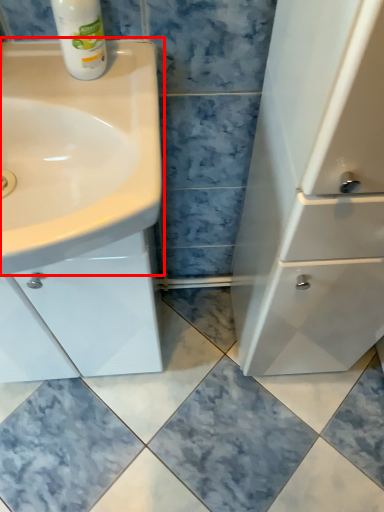
Question: Observing the image, what is the correct spatial positioning of sink (annotated by the red box) in reference to cleaning product?

Choices:
 (A) left
 (B) right

Answer: (A)